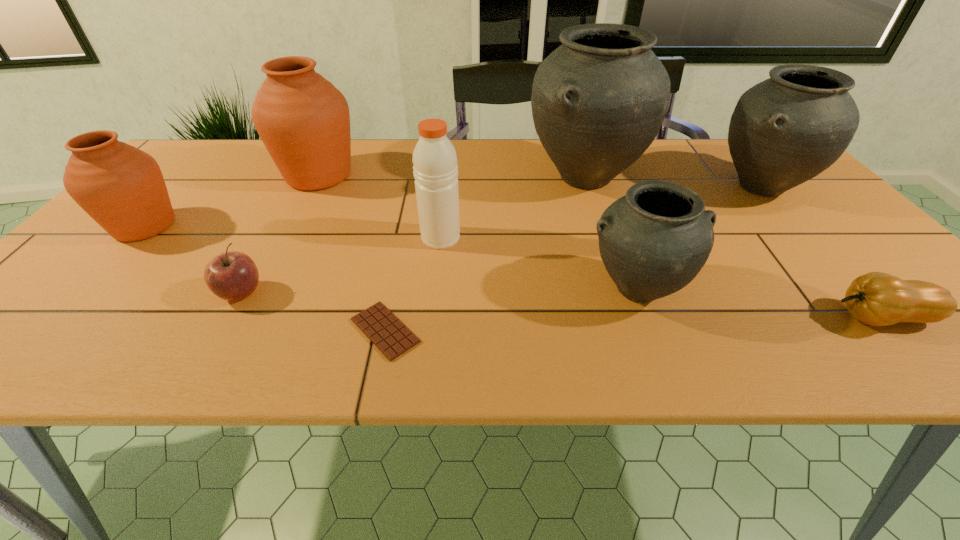
Locate an element on the screen. Image resolution: width=960 pixels, height=540 pixels. free space between the nearer brown urn and the shortest object is located at coordinates (265, 279).

Image resolution: width=960 pixels, height=540 pixels. I want to click on free space between the rightmost black urn and the apple, so click(x=501, y=240).

Locate an element on the screen. vacant point located between the smaller brown urn and the nearest urn is located at coordinates (391, 258).

Locate an element on the screen. object that stands as the third closest to the second smallest black urn is located at coordinates (878, 299).

Locate an element on the screen. The width and height of the screenshot is (960, 540). the closest object to the candy bar is located at coordinates (435, 169).

This screenshot has width=960, height=540. In order to click on urn that can be found as the fourth closest to the orange shaker in this screenshot , I will do `click(121, 187)`.

The width and height of the screenshot is (960, 540). Find the location of `urn identified as the third closest to the smallest black urn`. urn identified as the third closest to the smallest black urn is located at coordinates (303, 120).

Locate an element on the screen. black urn that is the closest to the tallest urn is located at coordinates (785, 130).

This screenshot has width=960, height=540. I want to click on the closest black urn relative to the biggest black urn, so click(785, 130).

Locate an element on the screen. The image size is (960, 540). blank area in the image that satisfies the following two spatial constraints: 1. on the front side of the left brown urn; 2. on the left side of the shaker is located at coordinates (134, 238).